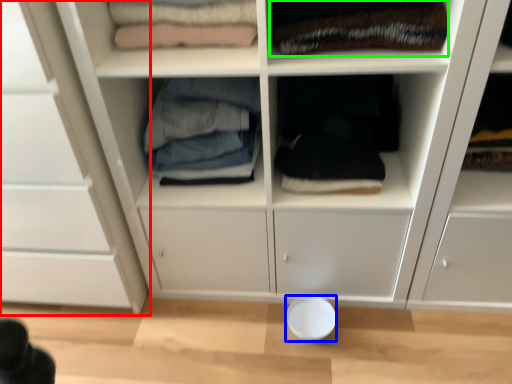
Question: Considering the real-world distances, which object is farthest from cupboard (highlighted by a red box)? bowl (highlighted by a blue box) or clothing (highlighted by a green box)?

Choices:
 (A) bowl
 (B) clothing

Answer: (A)